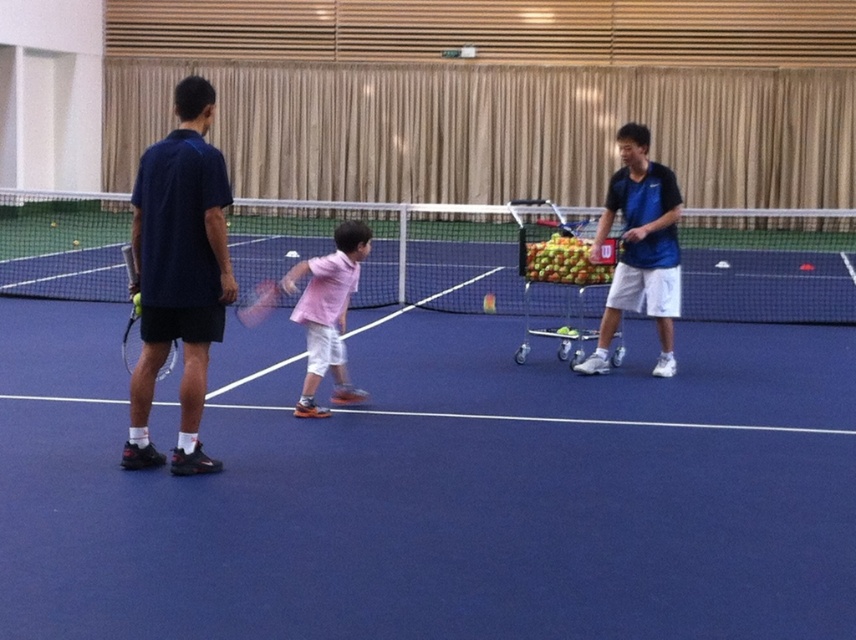
Question: Among these points, which one is farthest from the camera?

Choices:
 (A) (459, 324)
 (B) (122, 243)

Answer: (B)

Question: Which of the following is the closest to the observer?

Choices:
 (A) (566, 266)
 (B) (750, 269)
 (C) (120, 460)
 (D) (621, 196)

Answer: (C)

Question: Is matte black tennis racket at left below matte black tennis racket at center?

Choices:
 (A) no
 (B) yes

Answer: (A)

Question: Is matte blue shirt at left wider than matte black tennis racket at center?

Choices:
 (A) no
 (B) yes

Answer: (B)

Question: Which point is closer to the camera taking this photo?

Choices:
 (A) (633, 243)
 (B) (583, 253)
 (C) (253, 301)
 (D) (182, 294)

Answer: (D)

Question: Does pink matte shirt at center have a greater width compared to matte black tennis racket at center?

Choices:
 (A) no
 (B) yes

Answer: (B)